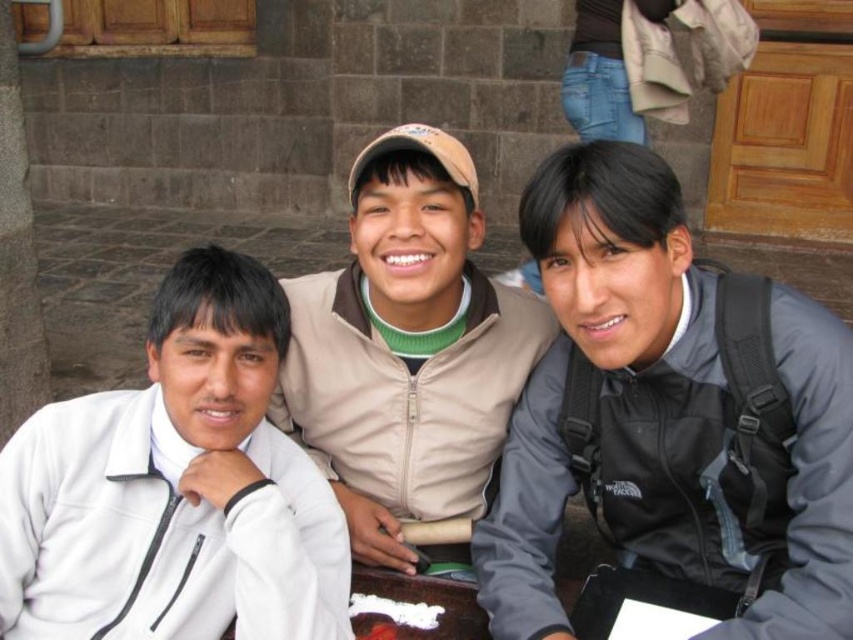
Question: Which is nearer to the white matte jacket at left?

Choices:
 (A) beige fleece jacket at center
 (B) gray matte jacket at center

Answer: (A)

Question: Which point is farther to the camera?

Choices:
 (A) beige fleece jacket at center
 (B) white matte jacket at left

Answer: (A)

Question: Can you confirm if white matte jacket at left is positioned below beige fleece jacket at center?

Choices:
 (A) yes
 (B) no

Answer: (A)

Question: Can you confirm if white matte jacket at left is positioned below beige fleece jacket at center?

Choices:
 (A) yes
 (B) no

Answer: (A)

Question: Which of the following is the farthest from the observer?

Choices:
 (A) (548, 440)
 (B) (376, 544)
 (C) (173, 365)

Answer: (B)

Question: Where is white matte jacket at left located in relation to beige fleece jacket at center in the image?

Choices:
 (A) left
 (B) right

Answer: (A)